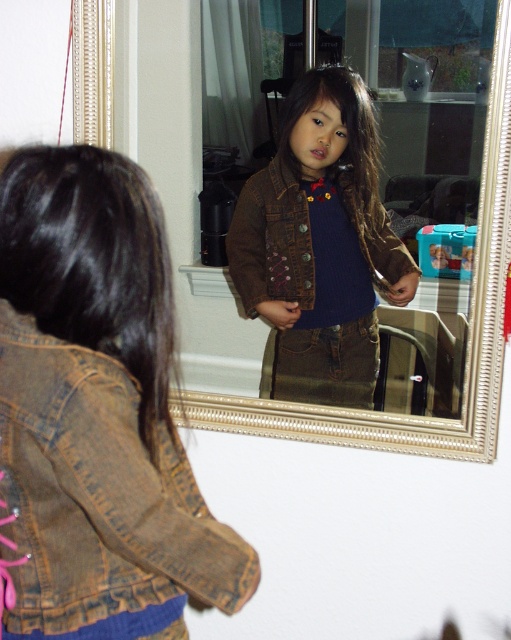
You are taking a photo of the scene and want to focus on both the girl and the mirror. Which point, point (131, 186) or point (310, 401), is closer to the camera and should be prioritized for focus?

Point (131, 186) is closer to the camera than point (310, 401), so it should be prioritized for focus.

You are standing in the room where the girl is examining her reflection in the mirror. You notice two points marked in the image. The first point is at coordinates point (x=36, y=156) and the second is at point (x=387, y=392). If you were to walk from the first point to the second point, would you be moving towards the mirror or away from it?

Since point (x=36, y=156) is in front of point (x=387, y=392), moving from the first point to the second point would mean moving away from the mirror.

You are a tailor measuring the width of the brown denim jacket at center and the brushed metal mirror at center. Which object has a greater width?

The brown denim jacket at center might be wider than brushed metal mirror at center, so it is possible that the brown denim jacket at center has a greater width.